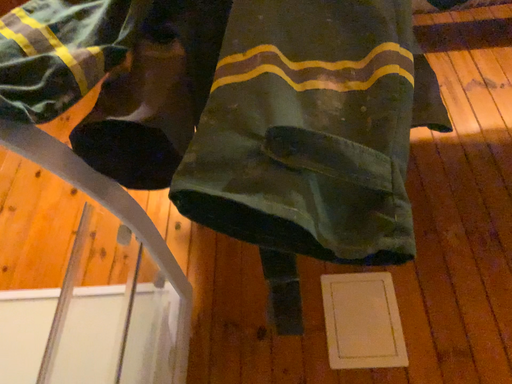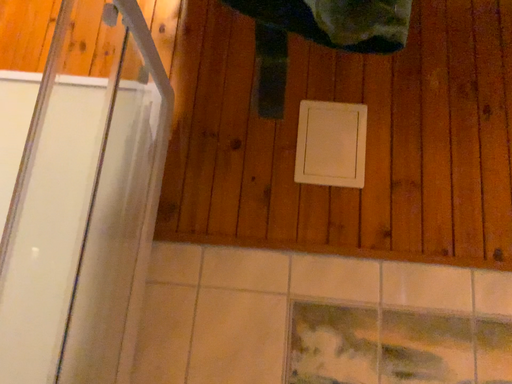
Question: Which way did the camera rotate in the video?

Choices:
 (A) rotated downward
 (B) rotated upward

Answer: (A)